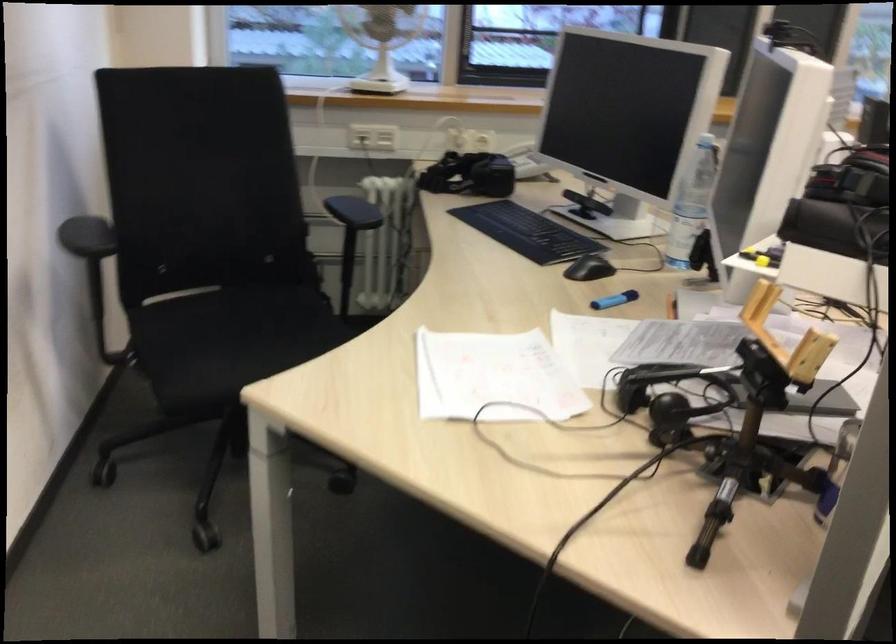
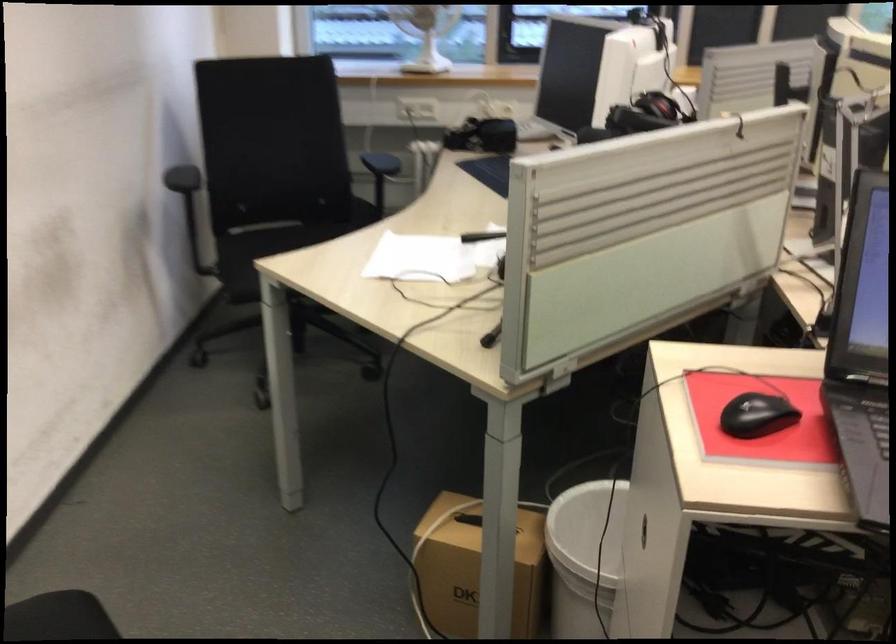
Find the pixel in the second image that matches point 489,375 in the first image.

(419, 259)